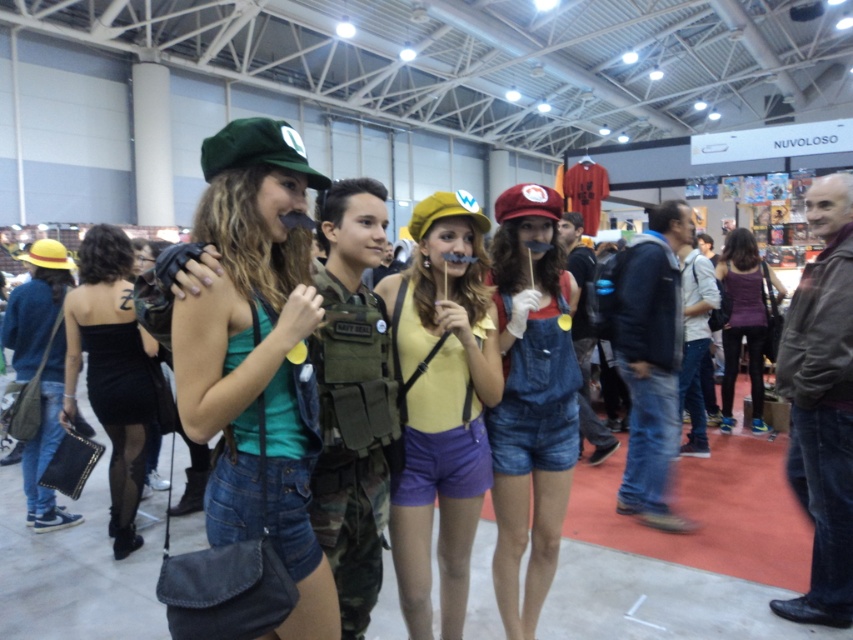
Question: Among these objects, which one is nearest to the camera?

Choices:
 (A) purple matte tank top at center
 (B) black satin dress at left
 (C) yellow matte tank top at center
 (D) matte green cap at upper left

Answer: (D)

Question: Does yellow matte tank top at center have a lesser width compared to black satin dress at left?

Choices:
 (A) yes
 (B) no

Answer: (A)

Question: Can you confirm if matte green cap at upper left is positioned below black satin dress at left?

Choices:
 (A) no
 (B) yes

Answer: (A)

Question: Which of the following is the closest to the observer?

Choices:
 (A) yellow matte tank top at center
 (B) matte green cap at upper left
 (C) purple matte tank top at center
 (D) black satin dress at left

Answer: (B)

Question: Can you confirm if yellow matte tank top at center is positioned above purple matte tank top at center?

Choices:
 (A) yes
 (B) no

Answer: (B)

Question: Which point is closer to the camera?

Choices:
 (A) black satin dress at left
 (B) yellow matte tank top at center
 (C) purple matte tank top at center
 (D) matte green cap at upper left

Answer: (D)